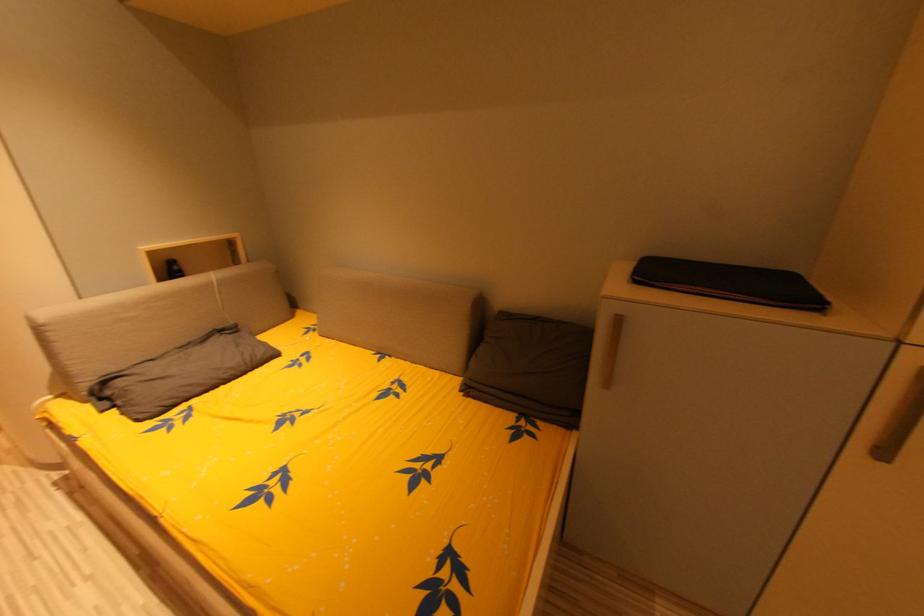
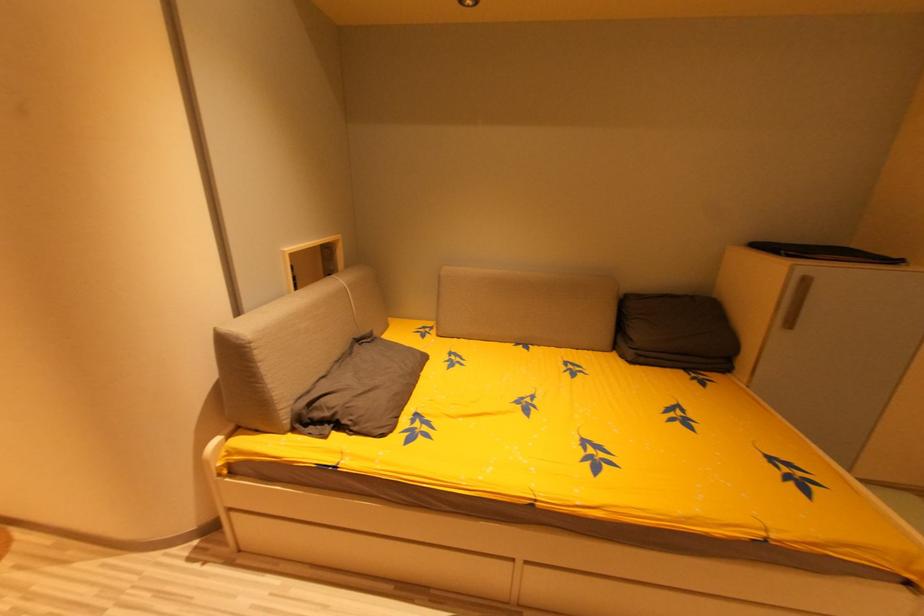
Question: The images are taken continuously from a first-person perspective. In which direction are you moving?

Choices:
 (A) Left
 (B) Right
 (C) Forward
 (D) Backward

Answer: (A)